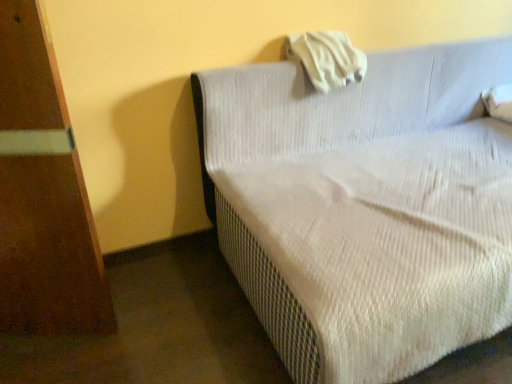
What is the approximate height of white textured fabric couch at center?

The height of white textured fabric couch at center is 29.27 inches.

What do you see at coordinates (365, 207) in the screenshot?
I see `white textured fabric couch at center` at bounding box center [365, 207].

Find the location of `white textured fabric couch at center`. white textured fabric couch at center is located at coordinates (365, 207).

What do you see at coordinates (326, 58) in the screenshot? I see `white fabric pillow at upper center` at bounding box center [326, 58].

You are a GUI agent. You are given a task and a screenshot of the screen. Output one action in this format:
    pyautogui.click(x=<x>, y=<y>)
    Task: Click on the white fabric pillow at upper center
    Image resolution: width=512 pixels, height=384 pixels.
    Given the screenshot: What is the action you would take?
    coord(326,58)

At what (x,y) coordinates should I click in order to perform the action: click on white textured fabric couch at center. Please return your answer as a coordinate pair (x, y). Looking at the image, I should click on (365, 207).

Can you confirm if white fabric pillow at upper center is positioned to the right of white textured fabric couch at center?

No.

Who is more distant, white fabric pillow at upper center or white textured fabric couch at center?

white fabric pillow at upper center is further from the camera.

Which is less distant, (314, 48) or (220, 178)?

The point (220, 178) is closer to the camera.

From the image's perspective, which object appears higher, white fabric pillow at upper center or white textured fabric couch at center?

white fabric pillow at upper center is shown above in the image.

From a real-world perspective, does white fabric pillow at upper center sit lower than white textured fabric couch at center?

No.

Looking at their sizes, would you say white fabric pillow at upper center is wider or thinner than white textured fabric couch at center?

Considering their sizes, white fabric pillow at upper center looks slimmer than white textured fabric couch at center.

Is white fabric pillow at upper center shorter than white textured fabric couch at center?

Indeed, white fabric pillow at upper center has a lesser height compared to white textured fabric couch at center.

In the scene shown: In terms of size, does white fabric pillow at upper center appear bigger or smaller than white textured fabric couch at center?

Considering their sizes, white fabric pillow at upper center takes up less space than white textured fabric couch at center.

Is white fabric pillow at upper center inside or outside of white textured fabric couch at center?

white fabric pillow at upper center exists entirely within white textured fabric couch at center.

Is white fabric pillow at upper center touching white textured fabric couch at center?

No, white fabric pillow at upper center is not touching white textured fabric couch at center.

Is white fabric pillow at upper center positioned with its back to white textured fabric couch at center?

Yes, white fabric pillow at upper center is facing away from white textured fabric couch at center.

At what (x,y) coordinates should I click in order to perform the action: click on studio couch beneath the white fabric pillow at upper center (from a real-world perspective). Please return your answer as a coordinate pair (x, y). This screenshot has height=384, width=512. Looking at the image, I should click on (365, 207).

Considering the relative positions of white textured fabric couch at center and white fabric pillow at upper center in the image provided, is white textured fabric couch at center to the left or to the right of white fabric pillow at upper center?

Clearly, white textured fabric couch at center is on the right of white fabric pillow at upper center in the image.

Considering the positions of objects white textured fabric couch at center and white fabric pillow at upper center in the image provided, who is in front, white textured fabric couch at center or white fabric pillow at upper center?

white textured fabric couch at center is closer to the camera.

Does point (305, 77) come in front of point (357, 74)?

Yes, point (305, 77) is closer to viewer.

From the image's perspective, between white textured fabric couch at center and white fabric pillow at upper center, which one is located above?

white fabric pillow at upper center, from the image's perspective.

From a real-world perspective, which object rests below the other?

white textured fabric couch at center is physically lower.

Which of these two, white textured fabric couch at center or white fabric pillow at upper center, is wider?

white textured fabric couch at center is wider.

In terms of height, does white textured fabric couch at center look taller or shorter compared to white fabric pillow at upper center?

In the image, white textured fabric couch at center appears to be taller than white fabric pillow at upper center.

Based on the photo, considering the sizes of objects white textured fabric couch at center and white fabric pillow at upper center in the image provided, who is bigger, white textured fabric couch at center or white fabric pillow at upper center?

white textured fabric couch at center is bigger.

Is white textured fabric couch at center located outside white fabric pillow at upper center?

Yes.

Is white textured fabric couch at center in contact with white fabric pillow at upper center?

No.

Is white textured fabric couch at center turned away from white fabric pillow at upper center?

Yes, white textured fabric couch at center is facing away from white fabric pillow at upper center.

Measure the distance between white textured fabric couch at center and white fabric pillow at upper center.

15.42 inches.

In the image, there is a white fabric pillow at upper center. Where is `studio couch below it (from the image's perspective)`? The image size is (512, 384). studio couch below it (from the image's perspective) is located at coordinates (365, 207).

Where is `studio couch on the right of white fabric pillow at upper center`? The image size is (512, 384). studio couch on the right of white fabric pillow at upper center is located at coordinates (365, 207).

At what (x,y) coordinates should I click in order to perform the action: click on pillow lying above the white textured fabric couch at center (from the image's perspective). Please return your answer as a coordinate pair (x, y). The image size is (512, 384). Looking at the image, I should click on (326, 58).